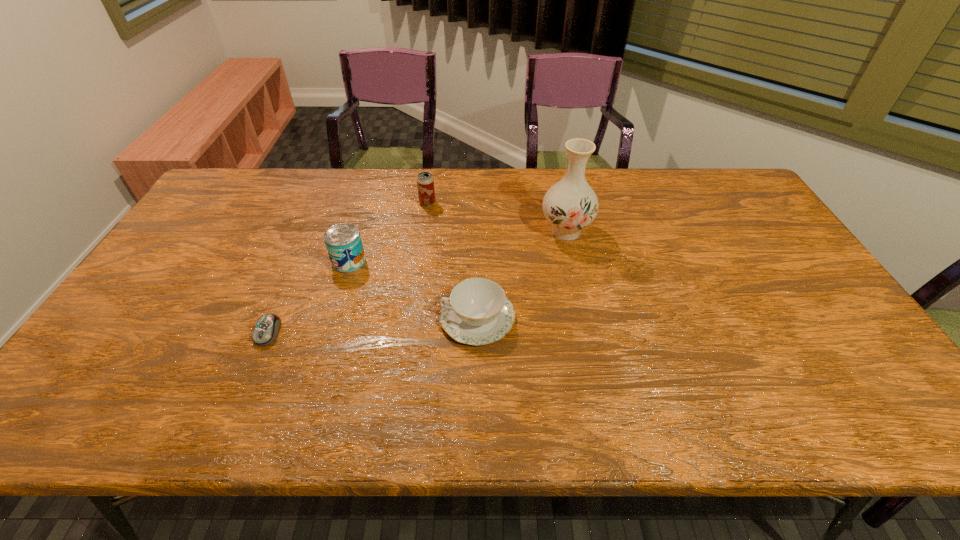
In the image, there is a desktop. What are the coordinates of `free space at the left edge` in the screenshot? It's located at (171, 273).

What are the coordinates of `vacant space at the right edge of the desktop` in the screenshot? It's located at coord(845,340).

Locate an element on the screen. This screenshot has height=540, width=960. vacant position at the far right corner of the desktop is located at coordinates (705, 181).

The image size is (960, 540). In order to click on vacant region at the near right corner in this screenshot , I will do `click(828, 399)`.

The image size is (960, 540). Identify the location of free space between the computer mouse and the fourth object from right to left. (308, 297).

The width and height of the screenshot is (960, 540). Find the location of `free space between the leftmost object and the can`. free space between the leftmost object and the can is located at coordinates (308, 297).

Where is `vacant area between the tallest object and the third nearest object`? vacant area between the tallest object and the third nearest object is located at coordinates (457, 246).

At what (x,y) coordinates should I click in order to perform the action: click on vacant space in between the can and the computer mouse. Please return your answer as a coordinate pair (x, y). This screenshot has width=960, height=540. Looking at the image, I should click on (308, 297).

At what (x,y) coordinates should I click in order to perform the action: click on vacant area that lies between the fourth object from left to right and the second object from left to right. Please return your answer as a coordinate pair (x, y). This screenshot has width=960, height=540. Looking at the image, I should click on (413, 289).

Find the location of a particular element. Image resolution: width=960 pixels, height=540 pixels. free space between the farthest object and the second shortest object is located at coordinates (452, 260).